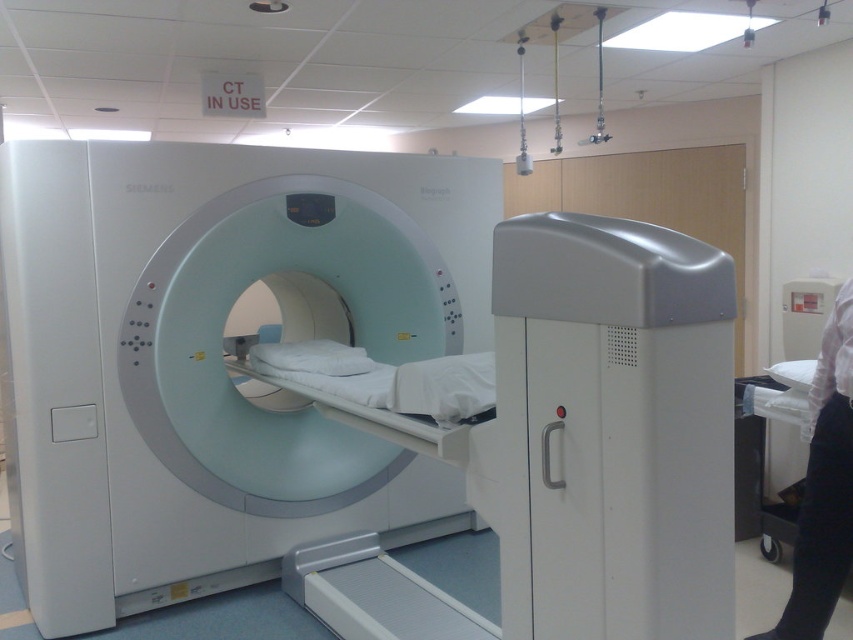
Question: Is white plastic mri scanner at center to the left of white glossy bed at center from the viewer's perspective?

Choices:
 (A) no
 (B) yes

Answer: (B)

Question: Which object is farther from the camera taking this photo?

Choices:
 (A) white glossy bed at center
 (B) white plastic mri scanner at center

Answer: (B)

Question: Does white plastic mri scanner at center have a larger size compared to white glossy bed at center?

Choices:
 (A) no
 (B) yes

Answer: (B)

Question: Which point is farther from the camera taking this photo?

Choices:
 (A) (589, 472)
 (B) (352, 166)

Answer: (B)

Question: Can you confirm if white plastic mri scanner at center is thinner than white glossy bed at center?

Choices:
 (A) yes
 (B) no

Answer: (B)